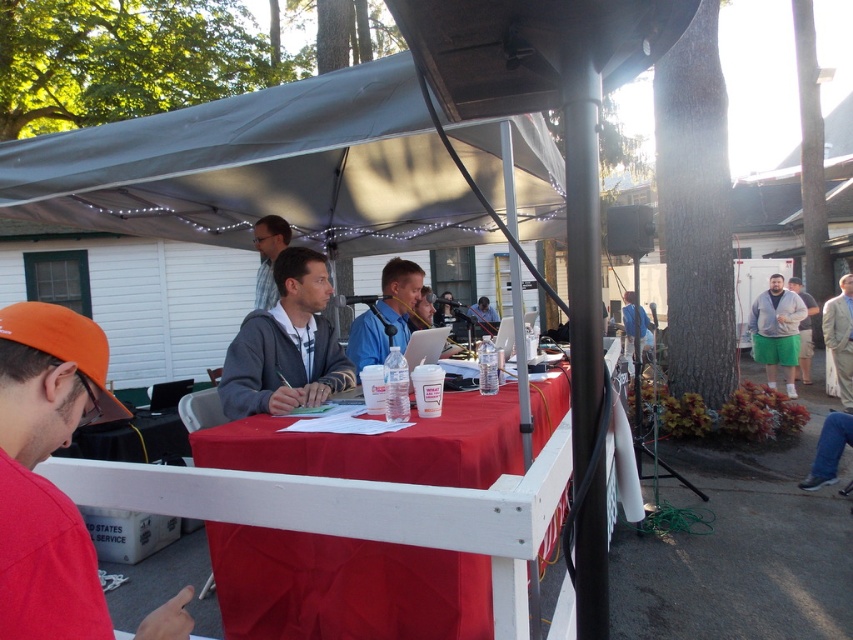
Is orange fabric cap at left wider than gray fleece vest at right?

No.

Is orange fabric cap at left taller than gray fleece vest at right?

No.

Is point (28, 547) closer to viewer compared to point (802, 317)?

Yes, point (28, 547) is in front of point (802, 317).

This screenshot has height=640, width=853. I want to click on orange fabric cap at left, so click(44, 477).

Does gray hoodie at center have a lesser width compared to tan fabric coat at right?

Yes.

Is gray hoodie at center taller than tan fabric coat at right?

No.

Is point (296, 364) positioned after point (846, 385)?

No, (296, 364) is in front of (846, 385).

The width and height of the screenshot is (853, 640). Identify the location of gray hoodie at center. (286, 346).

Between gray fabric canopy at upper center and green cotton shorts at right, which one has more height?

green cotton shorts at right

Can you confirm if gray fabric canopy at upper center is positioned to the left of green cotton shorts at right?

Indeed, gray fabric canopy at upper center is positioned on the left side of green cotton shorts at right.

Between point (296, 232) and point (804, 339), which one is positioned behind?

Point (804, 339)

Where is `gray fabric canopy at upper center`? Image resolution: width=853 pixels, height=640 pixels. gray fabric canopy at upper center is located at coordinates (260, 168).